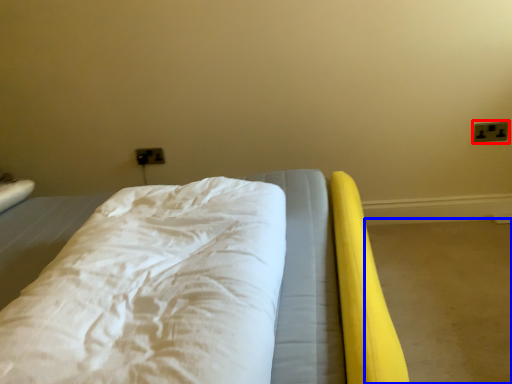
Question: Among these objects, which one is farthest to the camera, electric outlet (highlighted by a red box) or concrete (highlighted by a blue box)?

Choices:
 (A) electric outlet
 (B) concrete

Answer: (A)